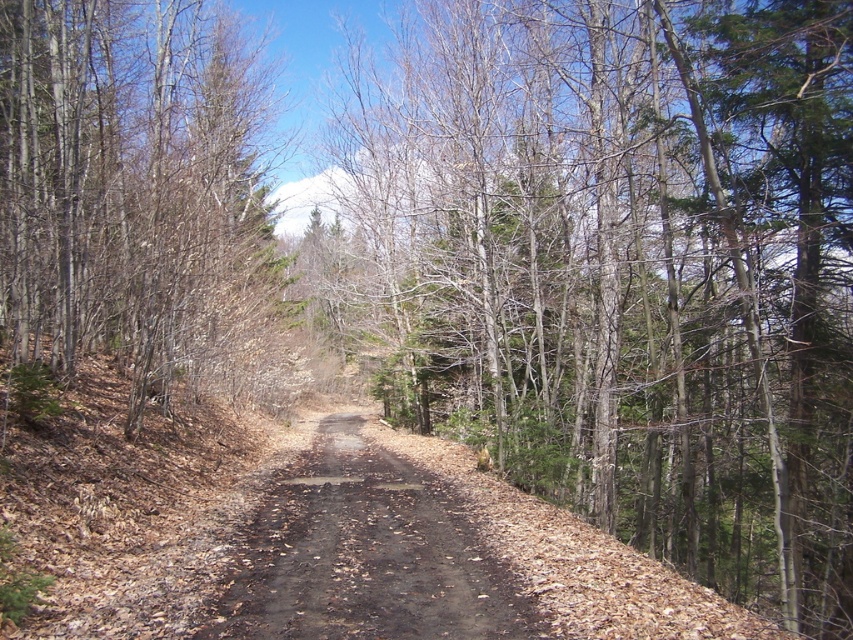
Question: Does brown bark tree at left have a greater width compared to brown dirt track at center?

Choices:
 (A) no
 (B) yes

Answer: (B)

Question: Which object appears farthest from the camera in this image?

Choices:
 (A) brown dirt track at center
 (B) brown/dry leaves at center

Answer: (B)

Question: Which of the following is the farthest from the observer?

Choices:
 (A) brown dirt track at center
 (B) brown bark tree at left

Answer: (B)

Question: Does brown/dry leaves at center appear over brown bark tree at left?

Choices:
 (A) no
 (B) yes

Answer: (A)

Question: Which point is closer to the camera?

Choices:
 (A) (456, 29)
 (B) (285, 474)
 (C) (93, 324)

Answer: (B)

Question: Is brown/dry leaves at center positioned in front of brown dirt track at center?

Choices:
 (A) yes
 (B) no

Answer: (B)